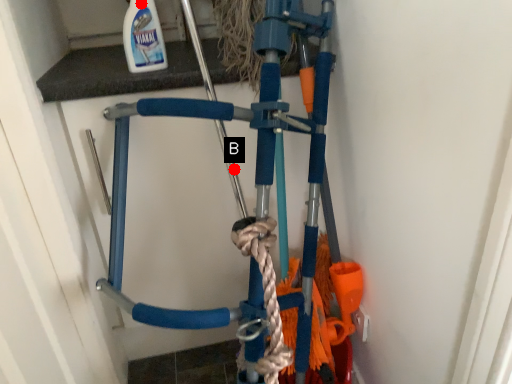
Question: Two points are circled on the image, labeled by A and B beside each circle. Which point appears farthest from the camera in this image?

Choices:
 (A) A is further
 (B) B is further

Answer: (B)